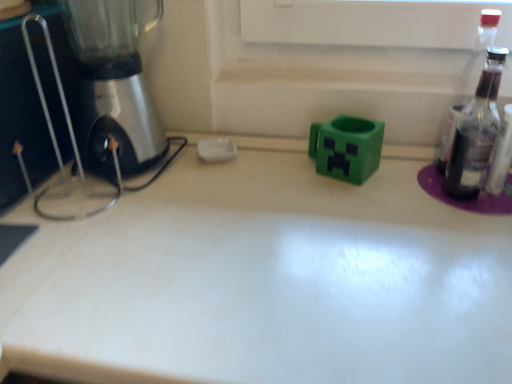
The height and width of the screenshot is (384, 512). Describe the element at coordinates (114, 85) in the screenshot. I see `metallic silver mixer at left` at that location.

The width and height of the screenshot is (512, 384). Describe the element at coordinates (347, 148) in the screenshot. I see `green matte plastic mug at center` at that location.

Locate an element on the screen. green matte plastic mug at center is located at coordinates (347, 148).

What is the approximate height of transparent glass bottle at right?

transparent glass bottle at right is 10.46 inches in height.

The height and width of the screenshot is (384, 512). What do you see at coordinates (264, 281) in the screenshot?
I see `white glossy countertop at center` at bounding box center [264, 281].

Locate an element on the screen. metallic silver mixer at left is located at coordinates (114, 85).

Considering the positions of objects metallic silver mixer at left and transparent glass bottle at right in the image provided, who is in front, metallic silver mixer at left or transparent glass bottle at right?

Positioned in front is metallic silver mixer at left.

Between metallic silver mixer at left and transparent glass bottle at right, which one appears on the right side from the viewer's perspective?

From the viewer's perspective, transparent glass bottle at right appears more on the right side.

Where is `bottle located behind the metallic silver mixer at left`? Image resolution: width=512 pixels, height=384 pixels. bottle located behind the metallic silver mixer at left is located at coordinates (467, 84).

Is metallic silver mixer at left surrounding transparent glass bottle at right?

Actually, transparent glass bottle at right is outside metallic silver mixer at left.

Measure the distance between white glossy countertop at center and metallic silver mixer at left.

12.54 inches.

Would you say white glossy countertop at center is outside metallic silver mixer at left?

Yes.

Between point (232, 206) and point (102, 136), which one is positioned in front?

The point (232, 206) is closer to the camera.

Which point is more forward, (93, 327) or (467, 100)?

The point (93, 327) is in front.

From a real-world perspective, is white glossy countertop at center located higher than transparent glass bottle at right?

No, from a real-world perspective, white glossy countertop at center is not on top of transparent glass bottle at right.

Is white glossy countertop at center facing towards transparent glass bottle at right?

No, white glossy countertop at center is not oriented towards transparent glass bottle at right.

Locate an element on the screen. The height and width of the screenshot is (384, 512). bottle above the white glossy countertop at center (from a real-world perspective) is located at coordinates (467, 84).

Is white glossy countertop at center not within green matte plastic mug at center?

That's correct, white glossy countertop at center is outside of green matte plastic mug at center.

Is white glossy countertop at center looking in the opposite direction of green matte plastic mug at center?

white glossy countertop at center is not turned away from green matte plastic mug at center.

Is white glossy countertop at center thinner than green matte plastic mug at center?

In fact, white glossy countertop at center might be wider than green matte plastic mug at center.

From the image's perspective, which one is positioned lower, white glossy countertop at center or green matte plastic mug at center?

white glossy countertop at center.

Considering the relative sizes of green matte plastic mug at center and white glossy countertop at center in the image provided, is green matte plastic mug at center bigger than white glossy countertop at center?

Incorrect, green matte plastic mug at center is not larger than white glossy countertop at center.

Which is more to the left, green matte plastic mug at center or white glossy countertop at center?

Positioned to the left is green matte plastic mug at center.

Find the location of a particular element. The image size is (512, 384). countertop lying below the green matte plastic mug at center (from the image's perspective) is located at coordinates (264, 281).

Is green matte plastic mug at center outside of white glossy countertop at center?

Indeed, green matte plastic mug at center is completely outside white glossy countertop at center.

Is transparent glass bottle at right looking in the opposite direction of white glossy countertop at center?

That's not correct — transparent glass bottle at right is not looking away from white glossy countertop at center.

From a real-world perspective, is transparent glass bottle at right physically below white glossy countertop at center?

No, from a real-world perspective, transparent glass bottle at right is not under white glossy countertop at center.

Is transparent glass bottle at right positioned before white glossy countertop at center?

No, it is behind white glossy countertop at center.

From their relative heights in the image, would you say transparent glass bottle at right is taller or shorter than white glossy countertop at center?

Considering their sizes, transparent glass bottle at right has less height than white glossy countertop at center.

Is point (377, 126) closer or farther from the camera than point (104, 65)?

Point (377, 126) appears to be farther away from the viewer than point (104, 65).

Is green matte plastic mug at center far away from metallic silver mixer at left?

No, green matte plastic mug at center is in close proximity to metallic silver mixer at left.

In the image, is green matte plastic mug at center on the left side or the right side of metallic silver mixer at left?

green matte plastic mug at center is positioned on metallic silver mixer at left's right side.

Choose the correct answer: Is green matte plastic mug at center inside metallic silver mixer at left or outside it?

green matte plastic mug at center is not enclosed by metallic silver mixer at left.

At what (x,y) coordinates should I click in order to perform the action: click on bottle behind the metallic silver mixer at left. Please return your answer as a coordinate pair (x, y). Looking at the image, I should click on (467, 84).

Identify the location of mixer above the white glossy countertop at center (from the image's perspective). (114, 85).

Based on their spatial positions, is white glossy countertop at center or transparent glass bottle at right further from green matte plastic mug at center?

white glossy countertop at center is positioned further to the anchor green matte plastic mug at center.

From the image, which object appears to be farther from transparent glass bottle at right, green matte plastic mug at center or white glossy countertop at center?

Among the two, white glossy countertop at center is located further to transparent glass bottle at right.

Considering their positions, is metallic silver mixer at left positioned closer to green matte plastic mug at center than transparent glass bottle at right?

transparent glass bottle at right.

Estimate the real-world distances between objects in this image. Which object is further from green matte plastic mug at center, transparent glass bottle at right or white glossy countertop at center?

Based on the image, white glossy countertop at center appears to be further to green matte plastic mug at center.

Based on their spatial positions, is white glossy countertop at center or metallic silver mixer at left closer to green matte plastic mug at center?

The object closer to green matte plastic mug at center is white glossy countertop at center.

Considering their positions, is transparent glass bottle at right positioned closer to white glossy countertop at center than green matte plastic mug at center?

Based on the image, green matte plastic mug at center appears to be nearer to white glossy countertop at center.

Looking at the image, which one is located further to transparent glass bottle at right, metallic silver mixer at left or white glossy countertop at center?

metallic silver mixer at left is positioned further to the anchor transparent glass bottle at right.

Considering their positions, is metallic silver mixer at left positioned further to white glossy countertop at center than green matte plastic mug at center?

metallic silver mixer at left.

At what (x,y) coordinates should I click in order to perform the action: click on bottle between metallic silver mixer at left and white glossy countertop at center vertically. Please return your answer as a coordinate pair (x, y). Looking at the image, I should click on (467, 84).

This screenshot has width=512, height=384. In order to click on appliance between metallic silver mixer at left and transparent glass bottle at right in the horizontal direction in this screenshot , I will do `click(347, 148)`.

At what (x,y) coordinates should I click in order to perform the action: click on appliance between metallic silver mixer at left and white glossy countertop at center from top to bottom. Please return your answer as a coordinate pair (x, y). The image size is (512, 384). Looking at the image, I should click on [347, 148].

In order to click on appliance between transparent glass bottle at right and white glossy countertop at center in the vertical direction in this screenshot , I will do `click(347, 148)`.